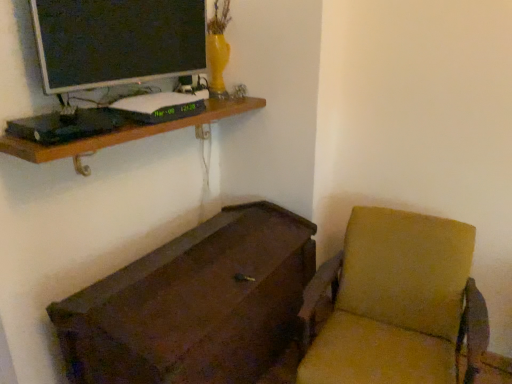
Question: Is brown wooden chest at lower left positioned behind brown wooden shelf at upper left?

Choices:
 (A) no
 (B) yes

Answer: (A)

Question: Considering the relative sizes of brown wooden chest at lower left and brown wooden shelf at upper left in the image provided, is brown wooden chest at lower left thinner than brown wooden shelf at upper left?

Choices:
 (A) yes
 (B) no

Answer: (B)

Question: Does brown wooden chest at lower left have a larger size compared to brown wooden shelf at upper left?

Choices:
 (A) yes
 (B) no

Answer: (A)

Question: Can you confirm if brown wooden chest at lower left is wider than brown wooden shelf at upper left?

Choices:
 (A) no
 (B) yes

Answer: (B)

Question: Could you tell me if brown wooden chest at lower left is facing brown wooden shelf at upper left?

Choices:
 (A) no
 (B) yes

Answer: (A)

Question: From a real-world perspective, is brown wooden chest at lower left above or below matte black monitor at upper left?

Choices:
 (A) below
 (B) above

Answer: (A)

Question: Would you say brown wooden chest at lower left is inside or outside matte black monitor at upper left?

Choices:
 (A) inside
 (B) outside

Answer: (B)

Question: Looking at the image, does brown wooden chest at lower left seem bigger or smaller compared to matte black monitor at upper left?

Choices:
 (A) small
 (B) big

Answer: (B)

Question: From the image's perspective, is brown wooden chest at lower left positioned above or below matte black monitor at upper left?

Choices:
 (A) above
 (B) below

Answer: (B)

Question: From the image's perspective, is brown wooden shelf at upper left located above or below brown wooden chest at lower left?

Choices:
 (A) above
 (B) below

Answer: (A)

Question: Considering the positions of point (116, 135) and point (86, 377), is point (116, 135) closer or farther from the camera than point (86, 377)?

Choices:
 (A) farther
 (B) closer

Answer: (B)

Question: Is brown wooden shelf at upper left inside the boundaries of brown wooden chest at lower left, or outside?

Choices:
 (A) outside
 (B) inside

Answer: (A)

Question: Would you say brown wooden shelf at upper left is to the left or to the right of brown wooden chest at lower left in the picture?

Choices:
 (A) right
 (B) left

Answer: (B)

Question: Does point (201, 321) appear closer or farther from the camera than point (115, 135)?

Choices:
 (A) closer
 (B) farther

Answer: (A)

Question: Is brown wooden chest at lower left wider or thinner than brown wooden shelf at upper left?

Choices:
 (A) thin
 (B) wide

Answer: (B)